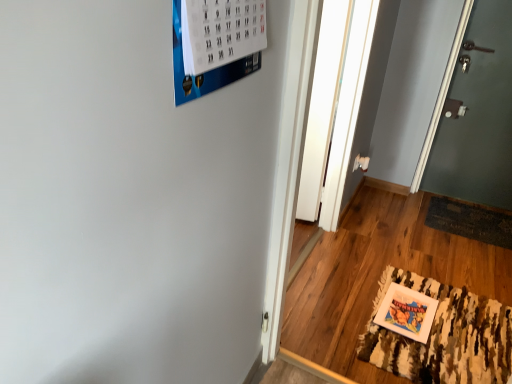
I want to click on blank space to the left of camouflage-patterned rug at lower right, so click(x=334, y=315).